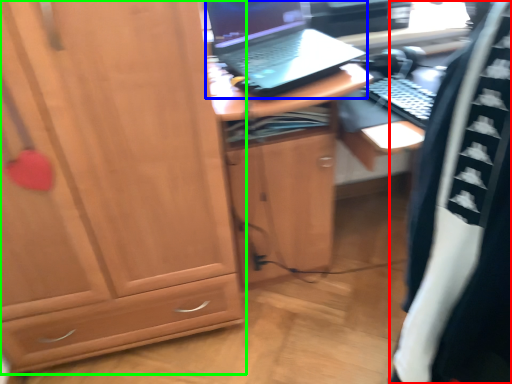
Question: Which object is the farthest from clothing (highlighted by a red box)? Choose among these: laptop (highlighted by a blue box) or cabinetry (highlighted by a green box).

Choices:
 (A) laptop
 (B) cabinetry

Answer: (A)